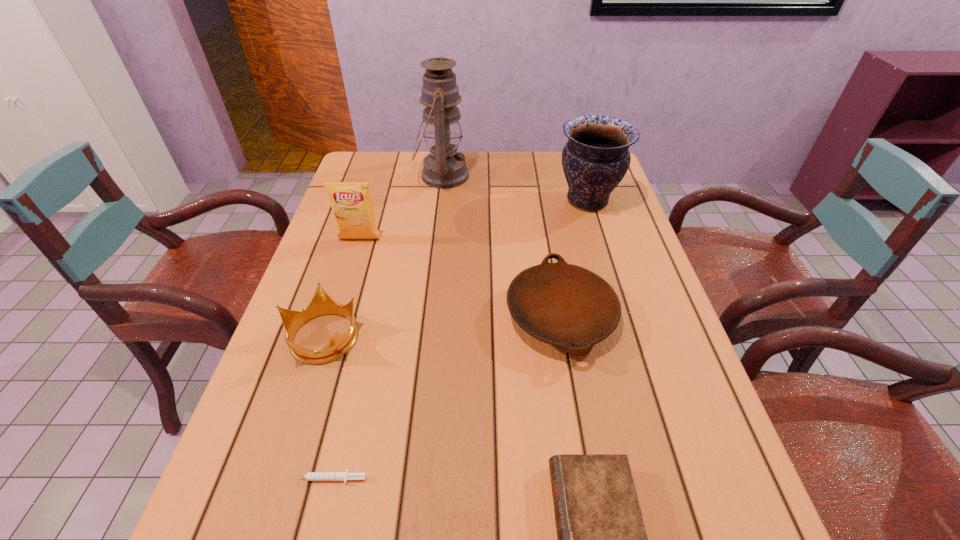
At what (x,y) coordinates should I click in order to perform the action: click on free space between the plate and the tallest object. Please return your answer as a coordinate pair (x, y). Looking at the image, I should click on (501, 246).

The image size is (960, 540). I want to click on free space between the fifth tallest object and the fifth nearest object, so click(460, 278).

Where is `empty space between the plate and the pottery`? Image resolution: width=960 pixels, height=540 pixels. empty space between the plate and the pottery is located at coordinates (574, 258).

Find the location of a particular element. This screenshot has height=540, width=960. empty location between the sixth shortest object and the plate is located at coordinates (574, 258).

The height and width of the screenshot is (540, 960). Find the location of `vacant space in between the oil lamp and the syringe`. vacant space in between the oil lamp and the syringe is located at coordinates (384, 327).

Identify which object is located as the third nearest to the fifth tallest object. Please provide its 2D coordinates. Your answer should be formatted as a tuple, i.e. [(x, y)], where the tuple contains the x and y coordinates of a point satisfying the conditions above.

[(321, 304)]

Locate which object is the fourth closest to the diary. Please provide its 2D coordinates. Your answer should be formatted as a tuple, i.e. [(x, y)], where the tuple contains the x and y coordinates of a point satisfying the conditions above.

[(595, 159)]

The height and width of the screenshot is (540, 960). In order to click on vacant area in the image that satisfies the following two spatial constraints: 1. on the front of the third farthest object with the logo; 2. on the right side of the fifth tallest object in this screenshot , I will do `click(336, 316)`.

Locate an element on the screen. The width and height of the screenshot is (960, 540). blank space that satisfies the following two spatial constraints: 1. on the back side of the oil lamp; 2. on the left side of the fourth shortest object is located at coordinates (374, 176).

Locate an element on the screen. The height and width of the screenshot is (540, 960). vacant position in the image that satisfies the following two spatial constraints: 1. on the front side of the shortest object; 2. on the right side of the crown is located at coordinates (276, 478).